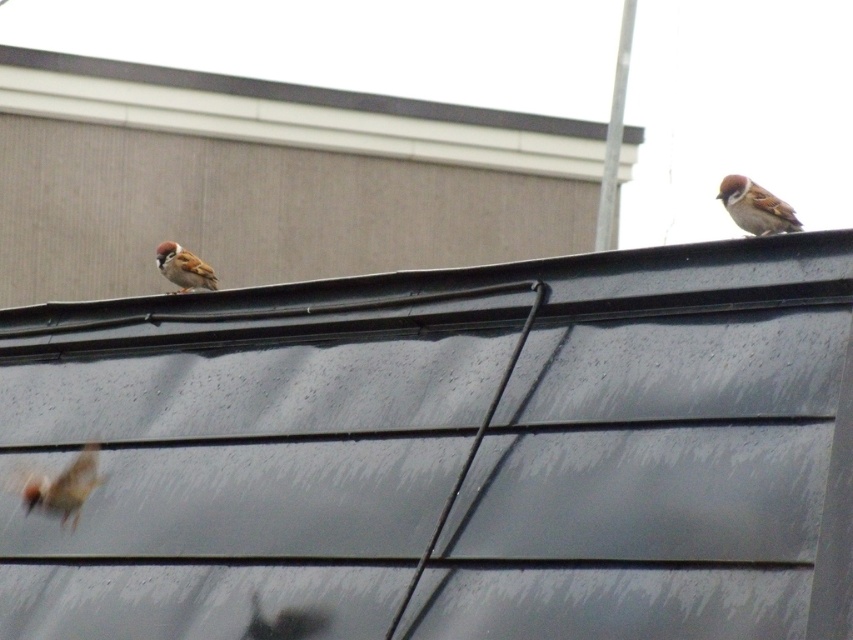
Consider the image. Can you confirm if gray matte roof at center is shorter than brown speckled feathers at upper right?

Incorrect, gray matte roof at center's height does not fall short of brown speckled feathers at upper right's.

Who is higher up, gray matte roof at center or brown speckled feathers at upper right?

brown speckled feathers at upper right

Which is in front, point (502, 426) or point (747, 220)?

Point (502, 426)

At what (x,y) coordinates should I click in order to perform the action: click on gray matte roof at center. Please return your answer as a coordinate pair (x, y). The width and height of the screenshot is (853, 640). Looking at the image, I should click on (445, 452).

In the scene shown: Is brown matte sparrow at lower left smaller than brown speckled feathers at upper right?

No.

Is point (50, 488) less distant than point (738, 220)?

No, (50, 488) is behind (738, 220).

Between point (86, 444) and point (756, 192), which one is positioned in front?

Positioned in front is point (756, 192).

Identify the location of brown matte sparrow at lower left. The width and height of the screenshot is (853, 640). point(62,486).

Can you confirm if brown speckled feathers at upper right is bigger than brown matte sparrow at left?

No, brown speckled feathers at upper right is not bigger than brown matte sparrow at left.

Which is behind, point (796, 227) or point (161, 268)?

Positioned behind is point (161, 268).

Who is more distant from viewer, [728,176] or [213,289]?

Positioned behind is point [213,289].

I want to click on brown speckled feathers at upper right, so click(755, 205).